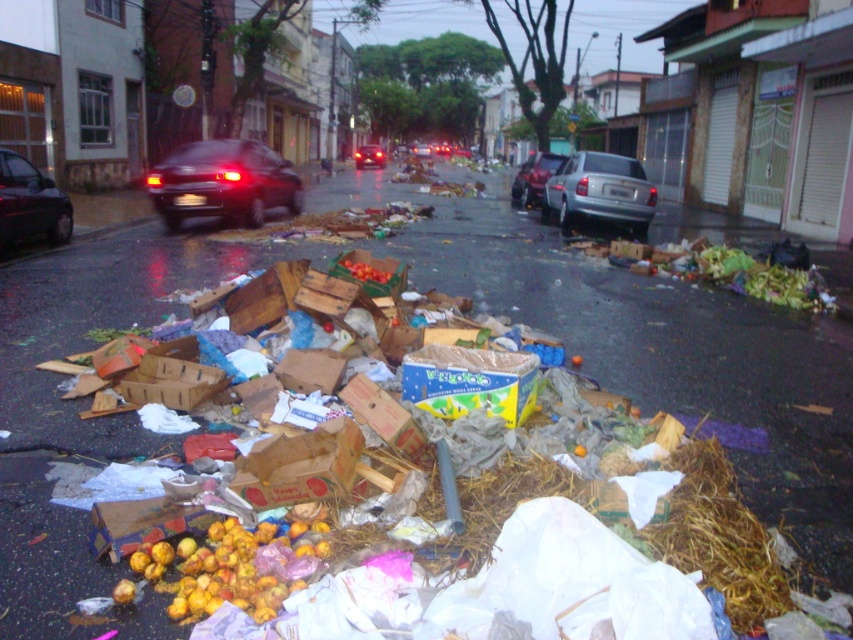
You are a pedestrian trying to cross the street safely. You see a glossy black car at left and a shiny black sedan at center. Which vehicle should you avoid first as they approach you from the front?

You should avoid the glossy black car at left first because it is closer to you than the shiny black sedan at center, meaning it will reach you sooner.

You are a delivery person carrying a box that is 2.5 meters long. You need to place it on the ground near the yellow matte fruit at lower left. Is there enough space between you and the fruit to place the box without it overlapping?

The yellow matte fruit at lower left is 2.60 meters from the camera. Since the box is 2.5 meters long, there is enough space to place it near the fruit without overlapping.